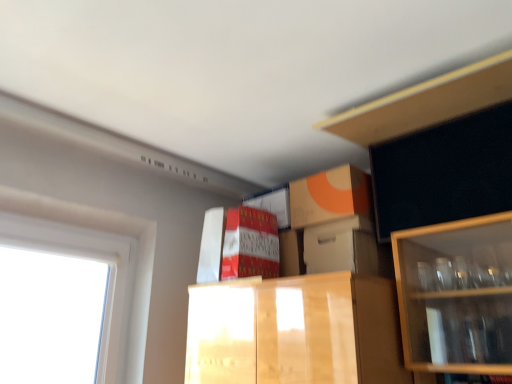
Question: In terms of height, does matte cardboard box at center look taller or shorter compared to white plastic window at left?

Choices:
 (A) tall
 (B) short

Answer: (B)

Question: From the image's perspective, is matte cardboard box at center located above or below white plastic window at left?

Choices:
 (A) above
 (B) below

Answer: (A)

Question: Which is nearer to the wooden cabinet at upper right?

Choices:
 (A) white plastic window at left
 (B) white cardboard box at center
 (C) matte cardboard box at center

Answer: (B)

Question: Which is farther from the matte cardboard box at center?

Choices:
 (A) white cardboard box at center
 (B) wooden cabinet at upper right
 (C) white plastic window at left

Answer: (B)